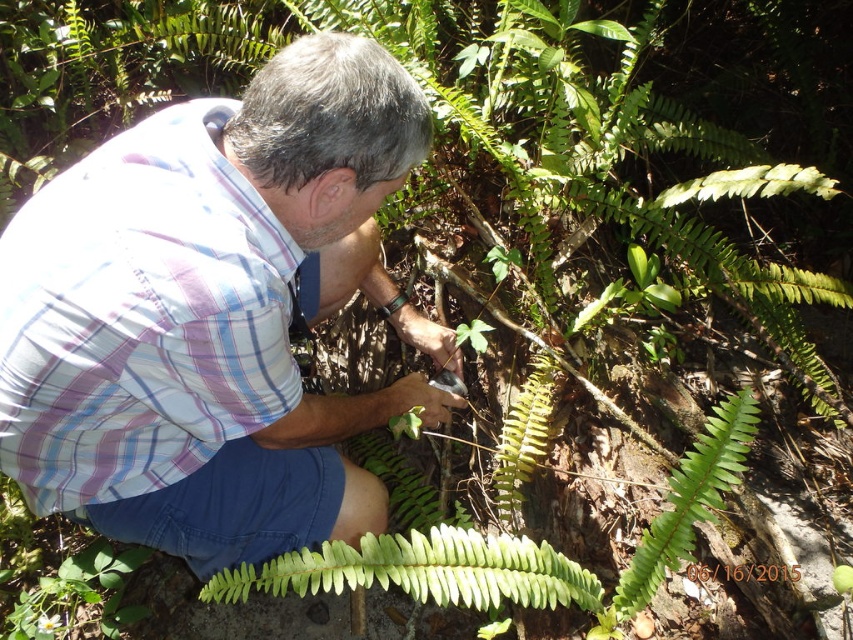
Which is more to the right, plaid fabric shirt at center or green leafy fern at center?

green leafy fern at center

Describe the element at coordinates (213, 314) in the screenshot. I see `plaid fabric shirt at center` at that location.

Where is `plaid fabric shirt at center`? This screenshot has width=853, height=640. plaid fabric shirt at center is located at coordinates (213, 314).